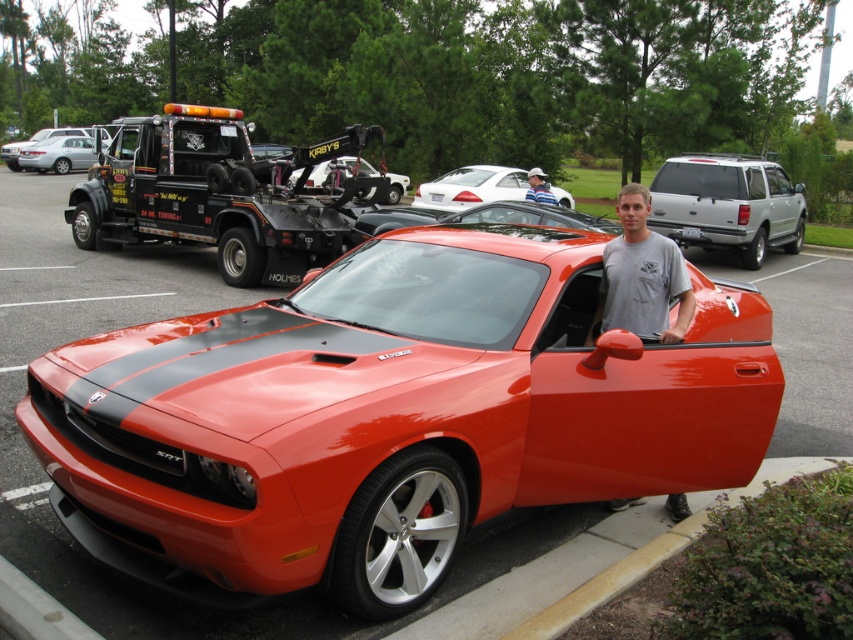
You are standing at the camera position and want to place a 2.5 meter long ladder on the ground between the concrete at lower right and the camera. Is there enough space to place the ladder horizontally without bending it?

The concrete at lower right and the camera are 2.88 meters apart, so yes, the ladder can be placed horizontally between the concrete at lower right and the camera since the distance is sufficient.

You are standing in front of the red Dodge Challenger SRT at the car show. There are two points marked on the car. One is at coordinate point (730,198) and the other is at point (482,179). Which point is closer to you?

Point (730,198) is closer to the viewer than point (482,179).